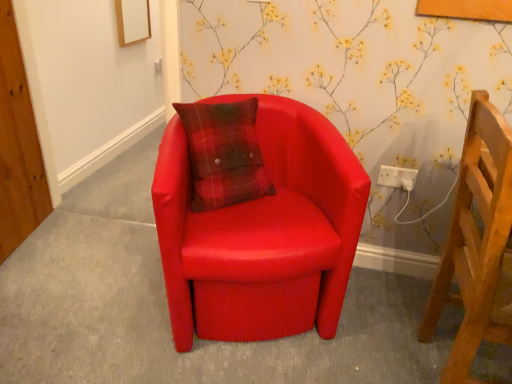
The height and width of the screenshot is (384, 512). Find the location of `white plastic socket at upper right`. white plastic socket at upper right is located at coordinates (397, 177).

The width and height of the screenshot is (512, 384). Describe the element at coordinates (397, 177) in the screenshot. I see `white plastic socket at upper right` at that location.

Where is `matte red armchair at center`? The height and width of the screenshot is (384, 512). matte red armchair at center is located at coordinates click(170, 326).

Locate an element on the screen. The image size is (512, 384). wooden chair at right, which appears as the 2th chair when viewed from the left is located at coordinates (475, 240).

Image resolution: width=512 pixels, height=384 pixels. In order to click on white plastic socket at upper right in this screenshot , I will do `click(397, 177)`.

Is matte leather chair at center, which ranks as the 1th chair in left-to-right order, looking in the opposite direction of matte red armchair at center?

No, matte leather chair at center, which ranks as the 1th chair in left-to-right order,'s orientation is not away from matte red armchair at center.

Where is `chair that is the 1st object located in front of the matte red armchair at center`? chair that is the 1st object located in front of the matte red armchair at center is located at coordinates (262, 233).

Considering the sizes of objects matte leather chair at center, which appears as the second chair when viewed from the right, and matte red armchair at center in the image provided, who is thinner, matte leather chair at center, which appears as the second chair when viewed from the right, or matte red armchair at center?

With smaller width is matte leather chair at center, which appears as the second chair when viewed from the right.

From a real-world perspective, is matte leather chair at center, which appears as the second chair when viewed from the right, under matte red armchair at center?

No, from a real-world perspective, matte leather chair at center, which appears as the second chair when viewed from the right, is not below matte red armchair at center.

Is point (482, 296) farther from viewer compared to point (384, 172)?

No.

Can you confirm if wooden chair at right, which appears as the 2th chair when viewed from the left, is positioned to the left of white plastic socket at upper right?

No, wooden chair at right, which appears as the 2th chair when viewed from the left, is not to the left of white plastic socket at upper right.

Which of these two, wooden chair at right, which appears as the 2th chair when viewed from the left, or white plastic socket at upper right, stands taller?

Standing taller between the two is wooden chair at right, which appears as the 2th chair when viewed from the left.

Considering the positions of objects matte leather chair at center, which appears as the second chair when viewed from the right, and wooden chair at right, positioned as the first chair in right-to-left order, in the image provided, who is more to the right, matte leather chair at center, which appears as the second chair when viewed from the right, or wooden chair at right, positioned as the first chair in right-to-left order,?

wooden chair at right, positioned as the first chair in right-to-left order, is more to the right.

Can you tell me how much matte leather chair at center, which appears as the second chair when viewed from the right, and wooden chair at right, which appears as the 2th chair when viewed from the left, differ in facing direction?

The facing directions of matte leather chair at center, which appears as the second chair when viewed from the right, and wooden chair at right, which appears as the 2th chair when viewed from the left, are 67.8 degrees apart.

Where is `chair on the left side of wooden chair at right, positioned as the first chair in right-to-left order`? chair on the left side of wooden chair at right, positioned as the first chair in right-to-left order is located at coordinates (262, 233).

Is matte leather chair at center, which ranks as the 1th chair in left-to-right order, not inside wooden chair at right, positioned as the first chair in right-to-left order?

Yes.

Is matte red armchair at center facing towards wooden chair at right, positioned as the first chair in right-to-left order?

No, matte red armchair at center does not turn towards wooden chair at right, positioned as the first chair in right-to-left order.

Considering the relative sizes of matte red armchair at center and wooden chair at right, which appears as the 2th chair when viewed from the left, in the image provided, is matte red armchair at center wider than wooden chair at right, which appears as the 2th chair when viewed from the left,?

Yes.

From the image's perspective, which is below, matte red armchair at center or wooden chair at right, which appears as the 2th chair when viewed from the left?

matte red armchair at center appears lower in the image.

Does matte red armchair at center lie behind wooden chair at right, positioned as the first chair in right-to-left order?

Yes, matte red armchair at center is further from the viewer.

Looking at this image, is wooden chair at right, which appears as the 2th chair when viewed from the left, thinner than matte leather chair at center, which ranks as the 1th chair in left-to-right order?

Answer: Correct, the width of wooden chair at right, which appears as the 2th chair when viewed from the left, is less than that of matte leather chair at center, which ranks as the 1th chair in left-to-right order.

Can you confirm if wooden chair at right, which appears as the 2th chair when viewed from the left, is positioned to the right of matte leather chair at center, which appears as the second chair when viewed from the right?

Yes.

From the image's perspective, is wooden chair at right, positioned as the first chair in right-to-left order, positioned above or below matte leather chair at center, which ranks as the 1th chair in left-to-right order?

wooden chair at right, positioned as the first chair in right-to-left order, is below matte leather chair at center, which ranks as the 1th chair in left-to-right order.

Does white plastic socket at upper right have a lesser width compared to wooden chair at right, which appears as the 2th chair when viewed from the left?

Correct, the width of white plastic socket at upper right is less than that of wooden chair at right, which appears as the 2th chair when viewed from the left.

Is white plastic socket at upper right far away from wooden chair at right, which appears as the 2th chair when viewed from the left?

No.

Considering their positions, is white plastic socket at upper right located in front of or behind wooden chair at right, which appears as the 2th chair when viewed from the left?

white plastic socket at upper right is behind wooden chair at right, which appears as the 2th chair when viewed from the left.

Is point (411, 185) in front of point (484, 160)?

No, it is not.

Is wooden chair at right, which appears as the 2th chair when viewed from the left, turned away from matte red armchair at center?

Yes, matte red armchair at center is at the back of wooden chair at right, which appears as the 2th chair when viewed from the left.

Which object is further away from the camera, wooden chair at right, which appears as the 2th chair when viewed from the left, or matte red armchair at center?

matte red armchair at center is more distant.

Would you say matte red armchair at center is part of wooden chair at right, which appears as the 2th chair when viewed from the left,'s contents?

No, matte red armchair at center is located outside of wooden chair at right, which appears as the 2th chair when viewed from the left.

From a real-world perspective, which chair is the 1st one above the matte red armchair at center? Please provide its 2D coordinates.

[(262, 233)]

Locate an element on the screen. electric outlet on the left of wooden chair at right, positioned as the first chair in right-to-left order is located at coordinates (397, 177).

Which object lies further to the anchor point wooden chair at right, which appears as the 2th chair when viewed from the left, matte red armchair at center or matte leather chair at center, which ranks as the 1th chair in left-to-right order?

matte red armchair at center lies further to wooden chair at right, which appears as the 2th chair when viewed from the left, than the other object.

From the image, which object appears to be nearer to wooden chair at right, positioned as the first chair in right-to-left order, matte red armchair at center or white plastic socket at upper right?

The object closer to wooden chair at right, positioned as the first chair in right-to-left order, is white plastic socket at upper right.

In the scene shown: Estimate the real-world distances between objects in this image. Which object is closer to white plastic socket at upper right, matte red armchair at center or matte leather chair at center, which appears as the second chair when viewed from the right?

matte leather chair at center, which appears as the second chair when viewed from the right, is closer to white plastic socket at upper right.

Estimate the real-world distances between objects in this image. Which object is closer to white plastic socket at upper right, matte red armchair at center or wooden chair at right, which appears as the 2th chair when viewed from the left?

wooden chair at right, which appears as the 2th chair when viewed from the left.

From the image, which object appears to be farther from wooden chair at right, positioned as the first chair in right-to-left order, white plastic socket at upper right or matte leather chair at center, which ranks as the 1th chair in left-to-right order?

white plastic socket at upper right lies further to wooden chair at right, positioned as the first chair in right-to-left order, than the other object.

Considering their positions, is white plastic socket at upper right positioned closer to matte leather chair at center, which ranks as the 1th chair in left-to-right order, than wooden chair at right, which appears as the 2th chair when viewed from the left?

wooden chair at right, which appears as the 2th chair when viewed from the left, is closer to matte leather chair at center, which ranks as the 1th chair in left-to-right order.

From the image, which object appears to be nearer to white plastic socket at upper right, wooden chair at right, positioned as the first chair in right-to-left order, or matte leather chair at center, which appears as the second chair when viewed from the right?

wooden chair at right, positioned as the first chair in right-to-left order, lies closer to white plastic socket at upper right than the other object.

When comparing their distances from white plastic socket at upper right, does wooden chair at right, which appears as the 2th chair when viewed from the left, or matte red armchair at center seem closer?

wooden chair at right, which appears as the 2th chair when viewed from the left, is positioned closer to the anchor white plastic socket at upper right.

The height and width of the screenshot is (384, 512). What are the coordinates of `chair between wooden chair at right, which appears as the 2th chair when viewed from the left, and white plastic socket at upper right from front to back` in the screenshot? It's located at (262, 233).

Locate an element on the screen. chair situated between matte red armchair at center and white plastic socket at upper right from left to right is located at coordinates (262, 233).

Find the location of a particular element. electric outlet between matte red armchair at center and wooden chair at right, positioned as the first chair in right-to-left order is located at coordinates (397, 177).

You are a GUI agent. You are given a task and a screenshot of the screen. Output one action in this format:
    pyautogui.click(x=<x>, y=<y>)
    Task: Click on the chair between matte red armchair at center and wooden chair at right, which appears as the 2th chair when viewed from the left, from left to right
    The image size is (512, 384).
    Given the screenshot: What is the action you would take?
    pyautogui.click(x=262, y=233)